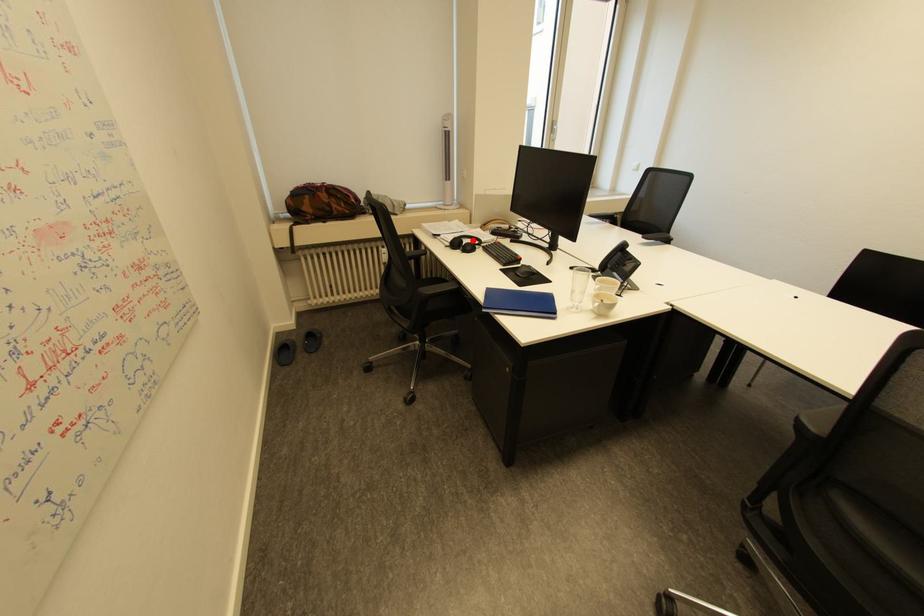
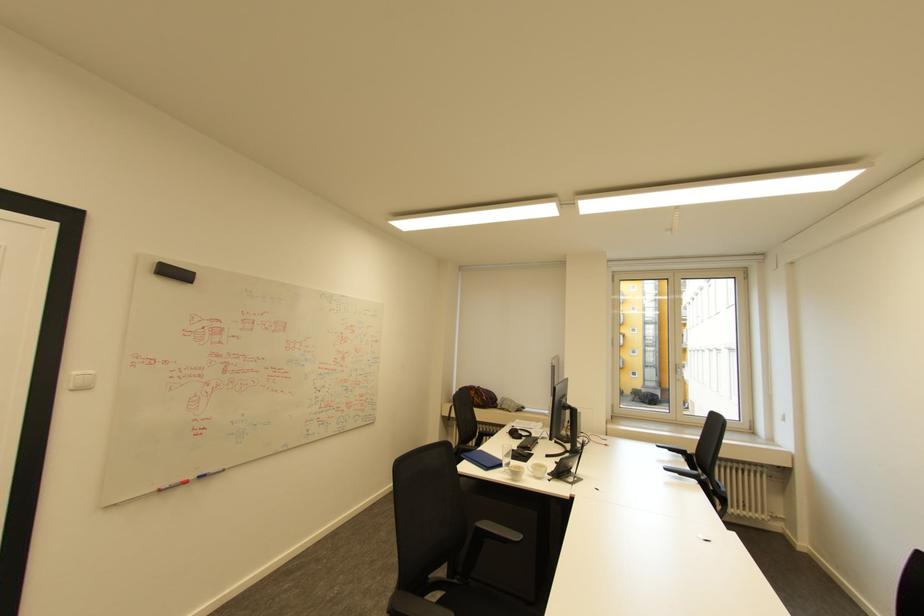
Find the pixel in the second image that matches the highlighted location in the first image.

(526, 432)